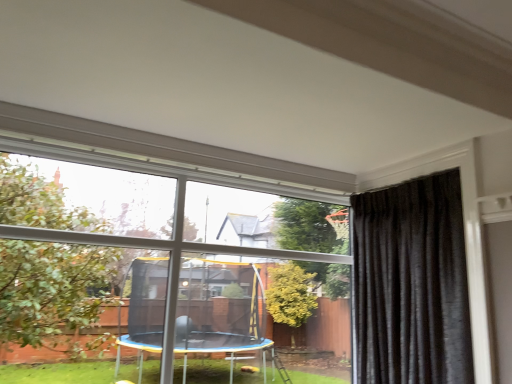
Question: Is black velvet curtain at right not within clear glass window at center?

Choices:
 (A) yes
 (B) no

Answer: (A)

Question: Is black velvet curtain at right wider than clear glass window at center?

Choices:
 (A) no
 (B) yes

Answer: (B)

Question: Considering the relative sizes of black velvet curtain at right and clear glass window at center in the image provided, is black velvet curtain at right shorter than clear glass window at center?

Choices:
 (A) yes
 (B) no

Answer: (A)

Question: Does black velvet curtain at right appear on the right side of clear glass window at center?

Choices:
 (A) no
 (B) yes

Answer: (B)

Question: Is black velvet curtain at right looking in the opposite direction of clear glass window at center?

Choices:
 (A) no
 (B) yes

Answer: (A)

Question: Is black velvet curtain at right bigger than clear glass window at center?

Choices:
 (A) no
 (B) yes

Answer: (A)

Question: Can you confirm if clear glass window at center is wider than black velvet curtain at right?

Choices:
 (A) no
 (B) yes

Answer: (A)

Question: Is clear glass window at center taller than black velvet curtain at right?

Choices:
 (A) no
 (B) yes

Answer: (B)

Question: From a real-world perspective, is clear glass window at center physically above black velvet curtain at right?

Choices:
 (A) yes
 (B) no

Answer: (B)

Question: Can black velvet curtain at right be found inside clear glass window at center?

Choices:
 (A) no
 (B) yes

Answer: (A)

Question: Is clear glass window at center closer to camera compared to black velvet curtain at right?

Choices:
 (A) yes
 (B) no

Answer: (A)

Question: Is clear glass window at center oriented away from black velvet curtain at right?

Choices:
 (A) yes
 (B) no

Answer: (B)

Question: Is black velvet curtain at right inside or outside of clear glass window at center?

Choices:
 (A) inside
 (B) outside

Answer: (B)